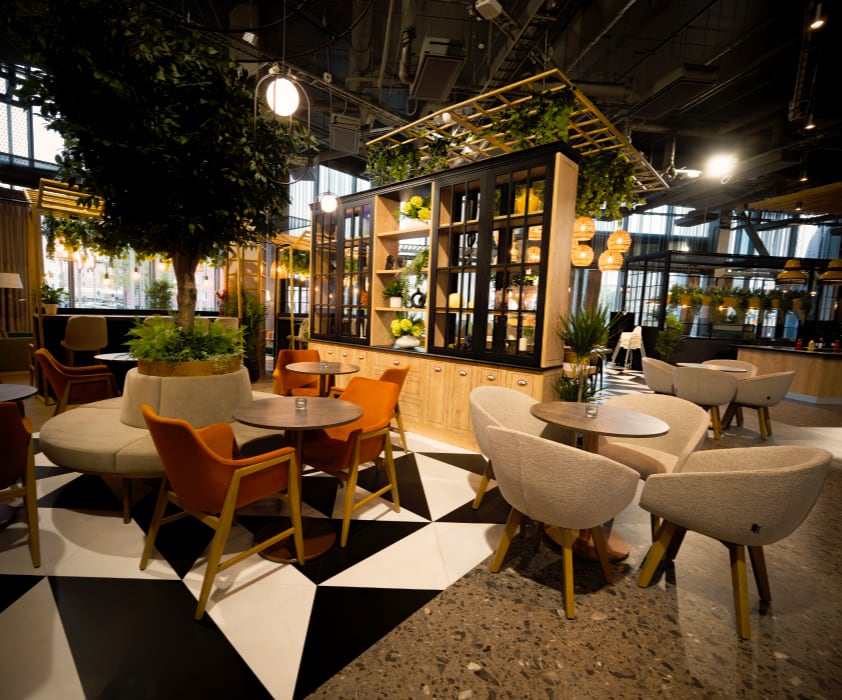
Identify the location of white tiles. The height and width of the screenshot is (700, 842). (45, 659), (91, 554), (251, 602), (444, 547), (448, 472), (419, 439), (388, 512), (56, 480), (40, 456).